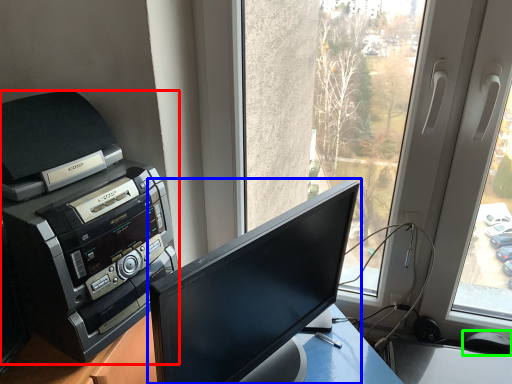
Question: Based on their relative distances, which object is farther from printer (highlighted by a red box)? Choose from computer monitor (highlighted by a blue box) and mouse (highlighted by a green box).

Choices:
 (A) computer monitor
 (B) mouse

Answer: (B)